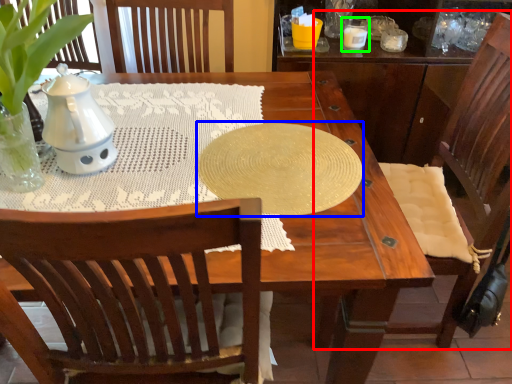
Question: Which object is positioned farthest from chair (highlighted by a red box)? Select from oval (highlighted by a blue box) and candle holder (highlighted by a green box).

Choices:
 (A) oval
 (B) candle holder

Answer: (B)